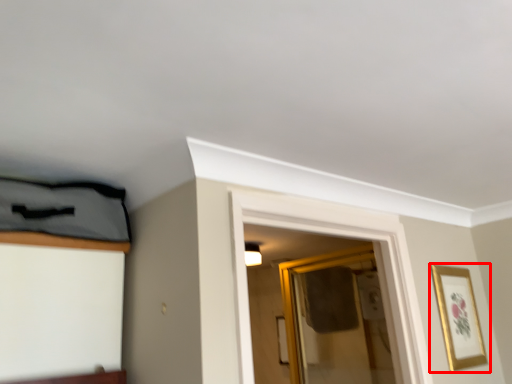
Question: In this image, where is picture frame (annotated by the red box) located relative to glass door?

Choices:
 (A) right
 (B) left

Answer: (A)